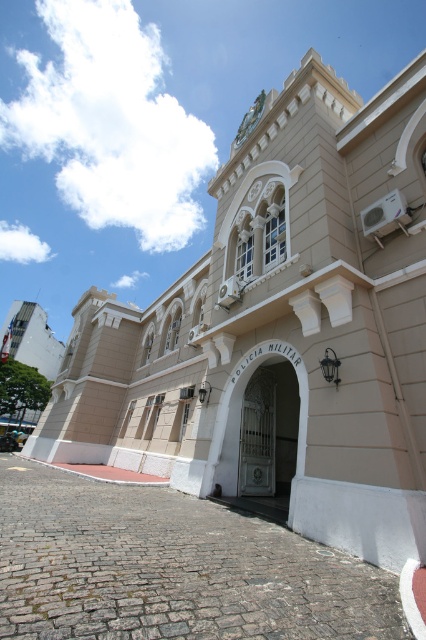
Between point (241, 392) and point (259, 102), which one is positioned behind?

The point (259, 102) is more distant.

What do you see at coordinates (241, 396) in the screenshot? The height and width of the screenshot is (640, 426). I see `white metal gate at center` at bounding box center [241, 396].

I want to click on white metal gate at center, so click(x=241, y=396).